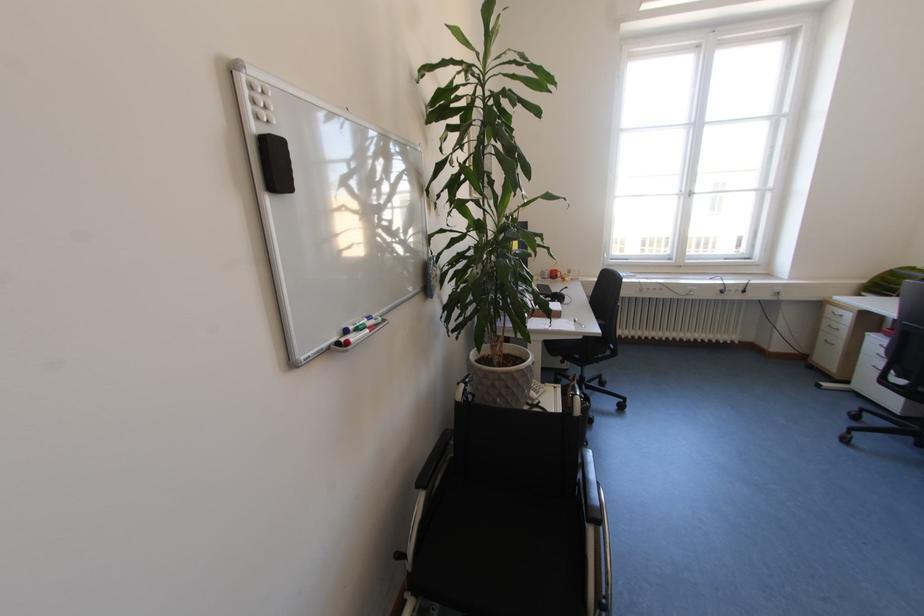
This screenshot has width=924, height=616. Describe the element at coordinates (576, 349) in the screenshot. I see `the chair sitting surface` at that location.